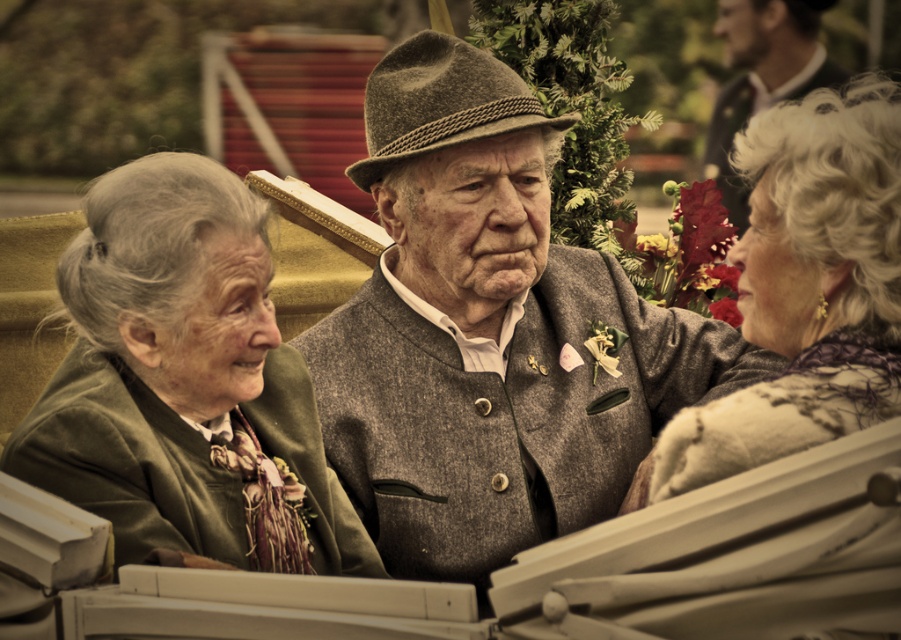
Locate an element on the screen. The image size is (901, 640). textured woolen jacket at center is located at coordinates (489, 332).

Between point (350, 470) and point (740, 216), which one is positioned in front?

Point (350, 470) is in front.

The height and width of the screenshot is (640, 901). What are the coordinates of `textured woolen jacket at center` in the screenshot? It's located at pyautogui.click(x=489, y=332).

Can you confirm if textured woolen jacket at center is bigger than matte gray scarf at right?

Yes.

Who is positioned more to the right, textured woolen jacket at center or matte gray scarf at right?

matte gray scarf at right

What are the coordinates of `textured woolen jacket at center` in the screenshot? It's located at (489, 332).

Does green woolen coat at left come behind dark gray wool jacket at upper right?

That is False.

Which of these two, green woolen coat at left or dark gray wool jacket at upper right, stands taller?

Standing taller between the two is dark gray wool jacket at upper right.

The height and width of the screenshot is (640, 901). What do you see at coordinates (185, 385) in the screenshot? I see `green woolen coat at left` at bounding box center [185, 385].

Where is `green woolen coat at left`? The width and height of the screenshot is (901, 640). green woolen coat at left is located at coordinates (185, 385).